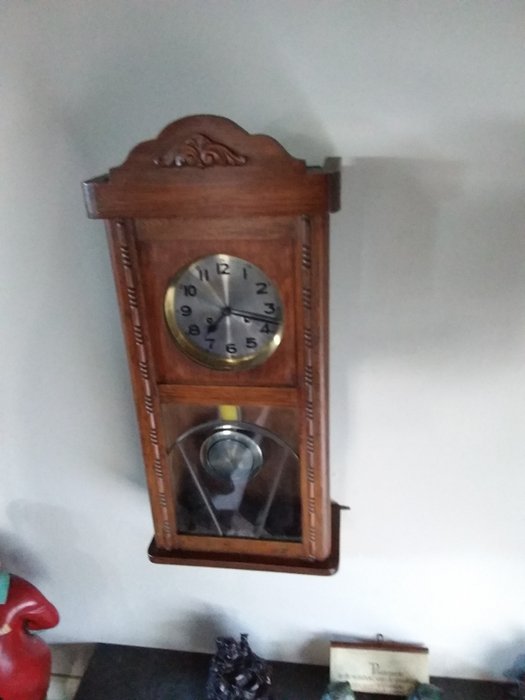
You are a GUI agent. You are given a task and a screenshot of the screen. Output one action in this format:
    pyautogui.click(x=<x>, y=<y>)
    Task: Click on the wall
    The height and width of the screenshot is (700, 525).
    Given the screenshot: What is the action you would take?
    pyautogui.click(x=482, y=410)